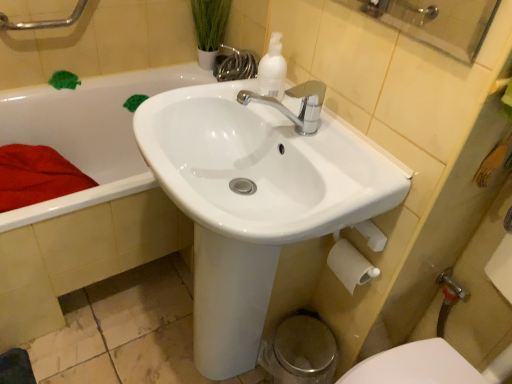
In order to click on vacant space in front of white matte pump bottle at upper center in this screenshot , I will do `click(297, 133)`.